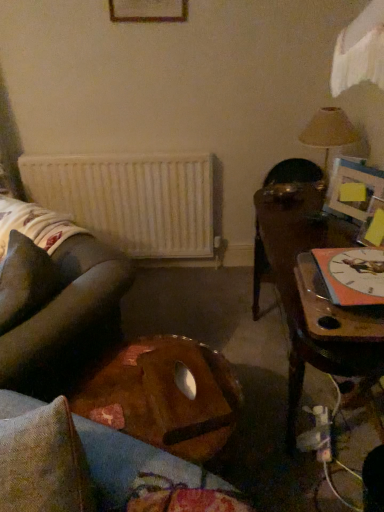
Question: From their relative heights in the image, would you say white matte radiator at center is taller or shorter than matte beige lampshade at upper right?

Choices:
 (A) short
 (B) tall

Answer: (B)

Question: From the image's perspective, is white matte radiator at center above or below matte beige lampshade at upper right?

Choices:
 (A) above
 (B) below

Answer: (B)

Question: Which is farther from the wooden tray at center, arranged as the 1th table when viewed from the left?

Choices:
 (A) matte beige lampshade at upper right
 (B) wooden picture frame at upper center
 (C) wooden table at right, the 2th table viewed from the left
 (D) brown fabric pillow at lower left
 (E) white matte radiator at center

Answer: (B)

Question: Estimate the real-world distances between objects in this image. Which object is farther from the matte beige lampshade at upper right?

Choices:
 (A) brown fabric pillow at lower left
 (B) wooden picture frame at upper center
 (C) wooden tray at center, the second table viewed from the right
 (D) white matte radiator at center
 (E) wooden table at right, the 2th table viewed from the left

Answer: (A)